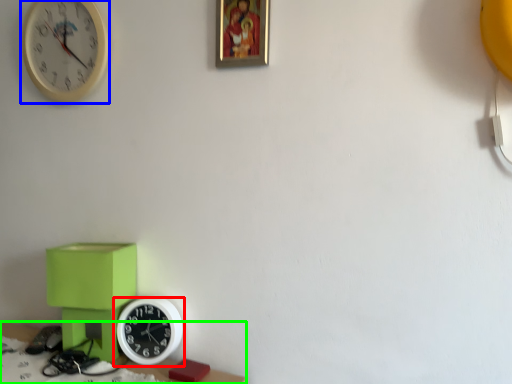
Question: Considering the real-world distances, which object is closest to wall clock (highlighted by a red box)? wall clock (highlighted by a blue box) or table (highlighted by a green box).

Choices:
 (A) wall clock
 (B) table

Answer: (B)